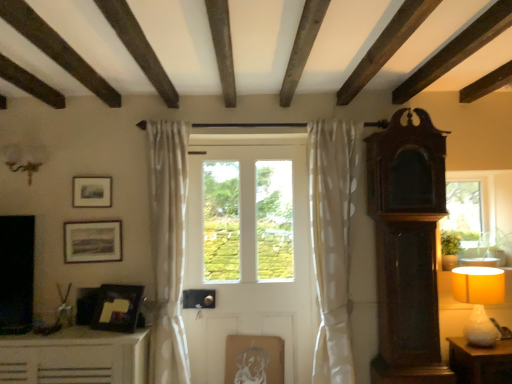
Identify the location of free point above white matte door at center (from a real-world perspective). This screenshot has height=384, width=512. (239, 144).